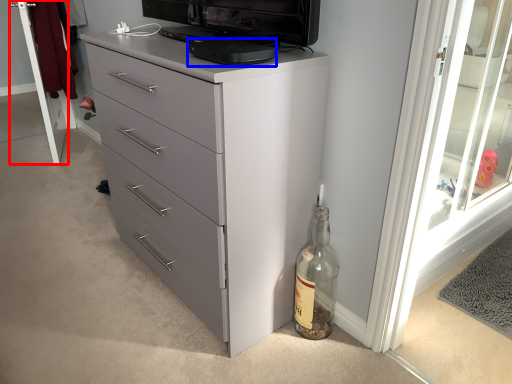
Question: Which object appears farthest to the camera in this image, screen door (highlighted by a red box) or appliance (highlighted by a blue box)?

Choices:
 (A) screen door
 (B) appliance

Answer: (A)